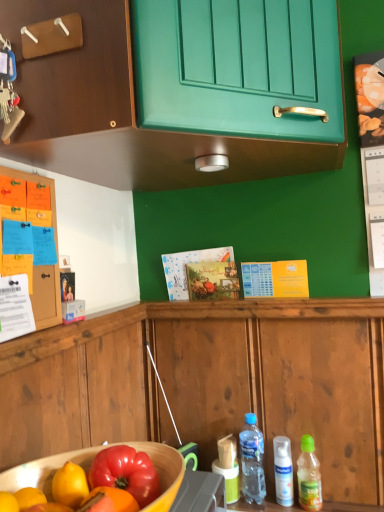
Question: Does green plastic bottle at lower right, which is counted as the third bottle, starting from the left, lie in front of white matte spray can at lower right, the 2th bottle from the left?

Choices:
 (A) yes
 (B) no

Answer: (A)

Question: Can you confirm if green plastic bottle at lower right, placed as the 1th bottle when sorted from right to left, is smaller than white matte spray can at lower right, the 2th bottle when ordered from right to left?

Choices:
 (A) no
 (B) yes

Answer: (A)

Question: Considering the relative sizes of green plastic bottle at lower right, which is counted as the third bottle, starting from the left, and white matte spray can at lower right, the 2th bottle when ordered from right to left, in the image provided, is green plastic bottle at lower right, which is counted as the third bottle, starting from the left, bigger than white matte spray can at lower right, the 2th bottle when ordered from right to left,?

Choices:
 (A) no
 (B) yes

Answer: (B)

Question: Considering the relative positions of green plastic bottle at lower right, which is counted as the third bottle, starting from the left, and white matte spray can at lower right, the 2th bottle when ordered from right to left, in the image provided, is green plastic bottle at lower right, which is counted as the third bottle, starting from the left, to the left of white matte spray can at lower right, the 2th bottle when ordered from right to left, from the viewer's perspective?

Choices:
 (A) yes
 (B) no

Answer: (B)

Question: Does green plastic bottle at lower right, which is counted as the third bottle, starting from the left, turn towards white matte spray can at lower right, the 2th bottle when ordered from right to left?

Choices:
 (A) no
 (B) yes

Answer: (A)

Question: From the image's perspective, is green plastic bottle at lower right, which is counted as the third bottle, starting from the left, located beneath white matte spray can at lower right, the 2th bottle when ordered from right to left?

Choices:
 (A) yes
 (B) no

Answer: (B)

Question: Is translucent plastic bottle at lower center, positioned as the first bottle in left-to-right order, inside wooden bowl at lower left?

Choices:
 (A) yes
 (B) no

Answer: (B)

Question: Considering the relative positions of wooden bowl at lower left and translucent plastic bottle at lower center, arranged as the third bottle when viewed from the right, in the image provided, is wooden bowl at lower left to the right of translucent plastic bottle at lower center, arranged as the third bottle when viewed from the right, from the viewer's perspective?

Choices:
 (A) yes
 (B) no

Answer: (B)

Question: Are wooden bowl at lower left and translucent plastic bottle at lower center, arranged as the third bottle when viewed from the right, beside each other?

Choices:
 (A) yes
 (B) no

Answer: (B)

Question: Is wooden bowl at lower left taller than translucent plastic bottle at lower center, arranged as the third bottle when viewed from the right?

Choices:
 (A) no
 (B) yes

Answer: (A)

Question: Is wooden bowl at lower left behind translucent plastic bottle at lower center, positioned as the first bottle in left-to-right order?

Choices:
 (A) yes
 (B) no

Answer: (B)

Question: Is wooden bowl at lower left oriented away from translucent plastic bottle at lower center, arranged as the third bottle when viewed from the right?

Choices:
 (A) yes
 (B) no

Answer: (B)

Question: From the image's perspective, would you say green matte cabinet at upper center, the 2th cabinetry when ordered from bottom to top, is shown under white matte spray can at lower right, the 2th bottle from the left?

Choices:
 (A) no
 (B) yes

Answer: (A)